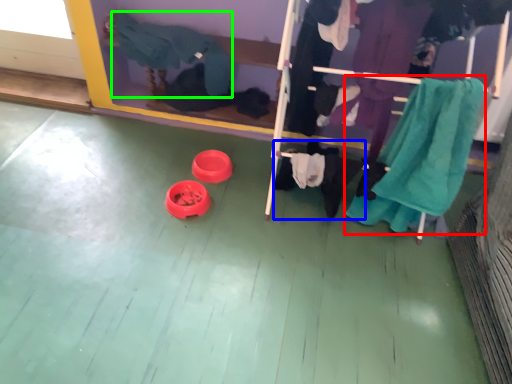
Question: Which is nearer to the clothing (highlighted by a red box)? clothing (highlighted by a blue box) or clothing (highlighted by a green box).

Choices:
 (A) clothing
 (B) clothing

Answer: (A)